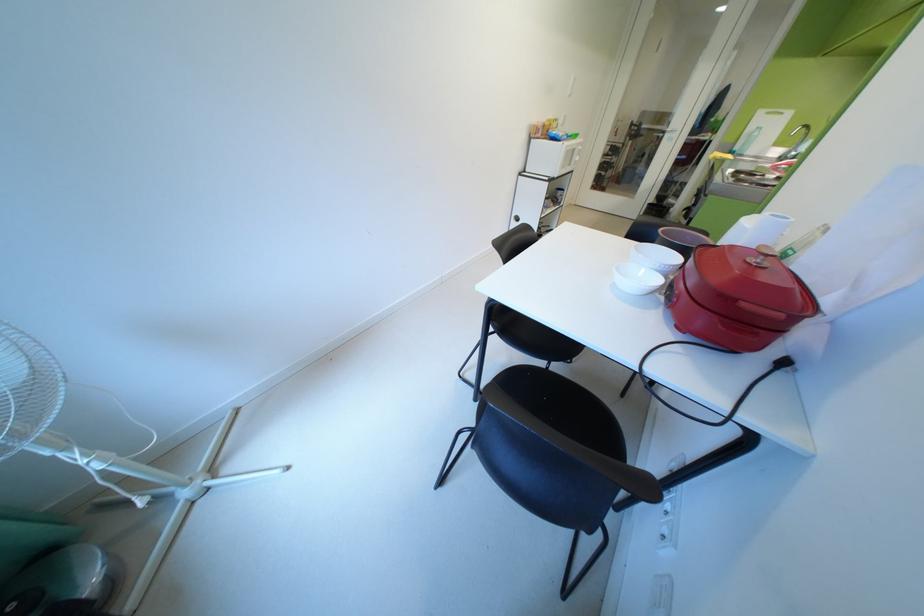
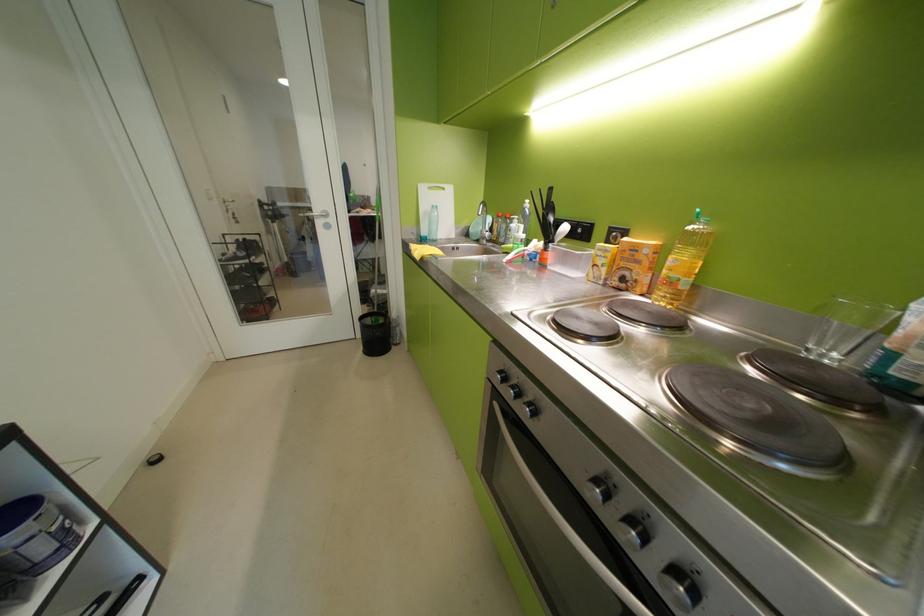
Find the pixel in the second image that matches pixel 772 114 in the first image.

(433, 190)